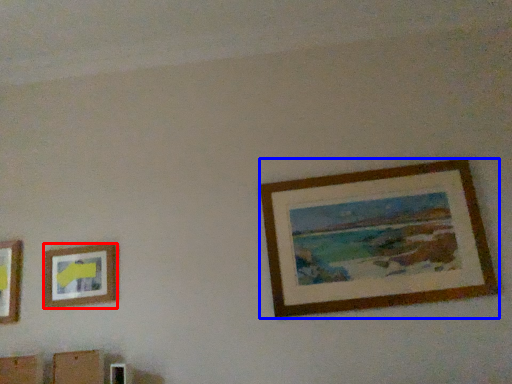
Question: Which of the following is the farthest to the observer, picture frame (highlighted by a red box) or picture frame (highlighted by a blue box)?

Choices:
 (A) picture frame
 (B) picture frame

Answer: (A)